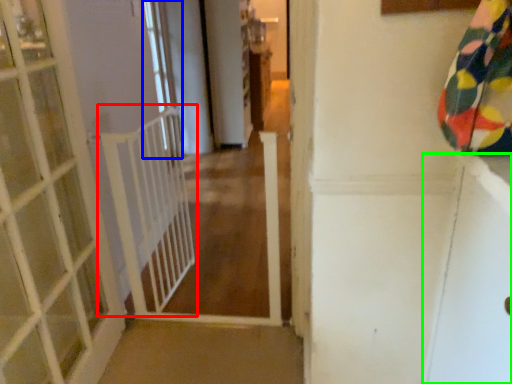
Question: Which object is positioned farthest from balustrade (highlighted by a red box)? Select from window (highlighted by a blue box) and screen door (highlighted by a green box).

Choices:
 (A) window
 (B) screen door

Answer: (A)